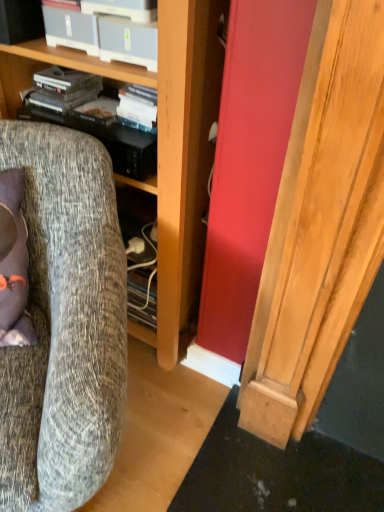
The image size is (384, 512). What do you see at coordinates (160, 146) in the screenshot?
I see `wooden cabinet at center` at bounding box center [160, 146].

Measure the distance between point [28,57] and camera.

Point [28,57] and camera are 1.07 meters apart from each other.

This screenshot has width=384, height=512. What do you see at coordinates (64, 325) in the screenshot?
I see `textured gray fabric chair at left` at bounding box center [64, 325].

You are a GUI agent. You are given a task and a screenshot of the screen. Output one action in this format:
    pyautogui.click(x=<x>, y=<y>)
    Task: Click on the wooden cabinet at center
    The height and width of the screenshot is (512, 384).
    Given the screenshot: What is the action you would take?
    pyautogui.click(x=160, y=146)

Does textured gray fabric chair at left turn towards wooden cabinet at center?

No, textured gray fabric chair at left is not oriented towards wooden cabinet at center.

From the image's perspective, between textured gray fabric chair at left and wooden cabinet at center, which one is located above?

wooden cabinet at center.

Is textured gray fabric chair at left smaller than wooden cabinet at center?

Yes.

How different are the orientations of wooden cabinet at center and matte black shelf at upper left in degrees?

0.000487 degrees separate the facing orientations of wooden cabinet at center and matte black shelf at upper left.

Is wooden cabinet at center inside the boundaries of matte black shelf at upper left, or outside?

wooden cabinet at center is spatially situated outside matte black shelf at upper left.

Considering the positions of points (138, 82) and (141, 72), is point (138, 82) closer to camera compared to point (141, 72)?

That is False.

Looking at this image, is wooden cabinet at center further to the viewer compared to matte black shelf at upper left?

No, wooden cabinet at center is in front of matte black shelf at upper left.

Is matte black shelf at upper left looking in the opposite direction of textured gray fabric chair at left?

matte black shelf at upper left is not turned away from textured gray fabric chair at left.

At what (x,y) coordinates should I click in order to perform the action: click on shelf behind the textured gray fabric chair at left. Please return your answer as a coordinate pair (x, y). Looking at the image, I should click on (54, 63).

From the picture: Does matte black shelf at upper left appear on the right side of textured gray fabric chair at left?

Indeed, matte black shelf at upper left is positioned on the right side of textured gray fabric chair at left.

From the picture: Who is taller, matte black shelf at upper left or textured gray fabric chair at left?

With more height is textured gray fabric chair at left.

Is wooden cabinet at center directly adjacent to textured gray fabric chair at left?

No, wooden cabinet at center is not next to textured gray fabric chair at left.

Is wooden cabinet at center shorter than textured gray fabric chair at left?

No, wooden cabinet at center is not shorter than textured gray fabric chair at left.

Is wooden cabinet at center facing away from textured gray fabric chair at left?

No, textured gray fabric chair at left is not at the back of wooden cabinet at center.

From the image's perspective, would you say wooden cabinet at center is shown under textured gray fabric chair at left?

No, from the image's perspective, wooden cabinet at center is not beneath textured gray fabric chair at left.

Considering the sizes of objects matte black shelf at upper left and wooden cabinet at center in the image provided, who is thinner, matte black shelf at upper left or wooden cabinet at center?

Thinner between the two is matte black shelf at upper left.

How many degrees apart are the facing directions of matte black shelf at upper left and wooden cabinet at center?

The facing directions of matte black shelf at upper left and wooden cabinet at center are 0.000487 degrees apart.

Is matte black shelf at upper left positioned in front of wooden cabinet at center?

No, matte black shelf at upper left is further to the viewer.

From a real-world perspective, is matte black shelf at upper left positioned under wooden cabinet at center based on gravity?

Incorrect, from a real-world perspective, matte black shelf at upper left is higher than wooden cabinet at center.

Is textured gray fabric chair at left bigger than matte black shelf at upper left?

Yes.

Based on the photo, is textured gray fabric chair at left further to the viewer compared to matte black shelf at upper left?

No, the depth of textured gray fabric chair at left is less than that of matte black shelf at upper left.

Between textured gray fabric chair at left and matte black shelf at upper left, which one appears on the right side from the viewer's perspective?

Positioned to the right is matte black shelf at upper left.

From the image's perspective, which one is positioned lower, textured gray fabric chair at left or matte black shelf at upper left?

From the image's view, textured gray fabric chair at left is below.

This screenshot has height=512, width=384. Find the location of `chair that appears below the wooden cabinet at center (from the image's perspective)`. chair that appears below the wooden cabinet at center (from the image's perspective) is located at coordinates (64, 325).

I want to click on cabinetry below the matte black shelf at upper left (from a real-world perspective), so click(x=160, y=146).

Estimate the real-world distances between objects in this image. Which object is further from wooden cabinet at center, textured gray fabric chair at left or matte black shelf at upper left?

textured gray fabric chair at left.

Based on their spatial positions, is wooden cabinet at center or textured gray fabric chair at left closer to matte black shelf at upper left?

wooden cabinet at center lies closer to matte black shelf at upper left than the other object.

Considering their positions, is wooden cabinet at center positioned closer to textured gray fabric chair at left than matte black shelf at upper left?

Among the two, wooden cabinet at center is located nearer to textured gray fabric chair at left.

Looking at the image, which one is located closer to textured gray fabric chair at left, matte black shelf at upper left or wooden cabinet at center?

wooden cabinet at center.

Which object lies further to the anchor point matte black shelf at upper left, textured gray fabric chair at left or wooden cabinet at center?

textured gray fabric chair at left lies further to matte black shelf at upper left than the other object.

From the image, which object appears to be nearer to wooden cabinet at center, matte black shelf at upper left or textured gray fabric chair at left?

Among the two, matte black shelf at upper left is located nearer to wooden cabinet at center.

The width and height of the screenshot is (384, 512). I want to click on cabinetry between matte black shelf at upper left and textured gray fabric chair at left vertically, so click(160, 146).